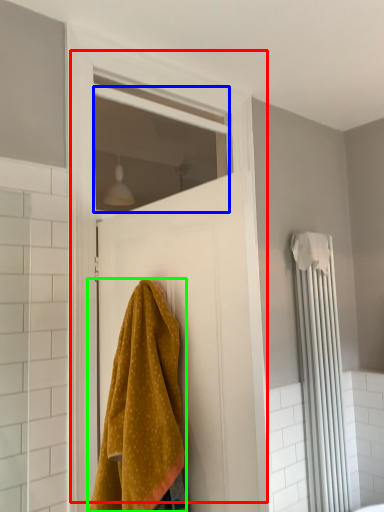
Question: Which is nearer to the door (highlighted by a red box)? window (highlighted by a blue box) or towel (highlighted by a green box).

Choices:
 (A) window
 (B) towel

Answer: (B)